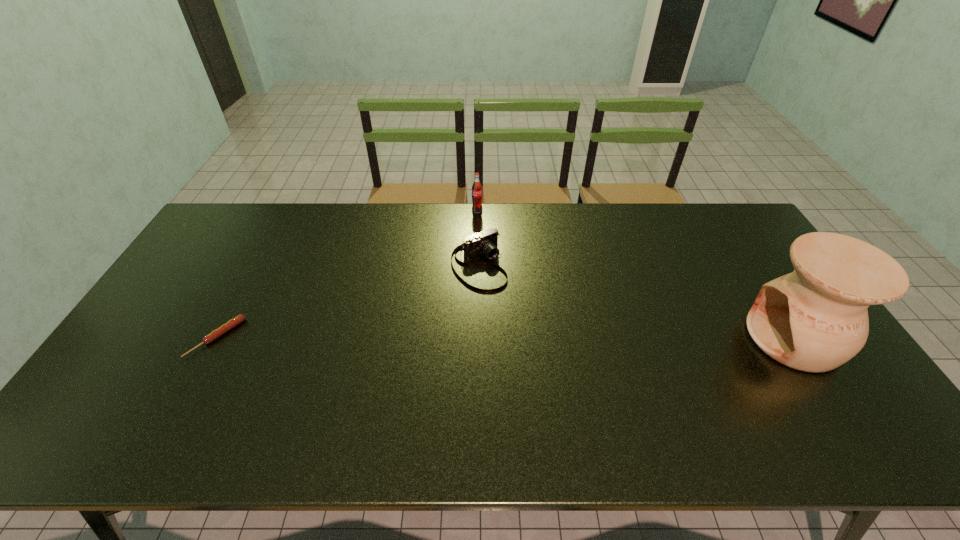
Where is `vacant space that satisfies the following two spatial constraints: 1. on the back side of the sausage; 2. at the open side of the pottery`? This screenshot has height=540, width=960. vacant space that satisfies the following two spatial constraints: 1. on the back side of the sausage; 2. at the open side of the pottery is located at coordinates (217, 338).